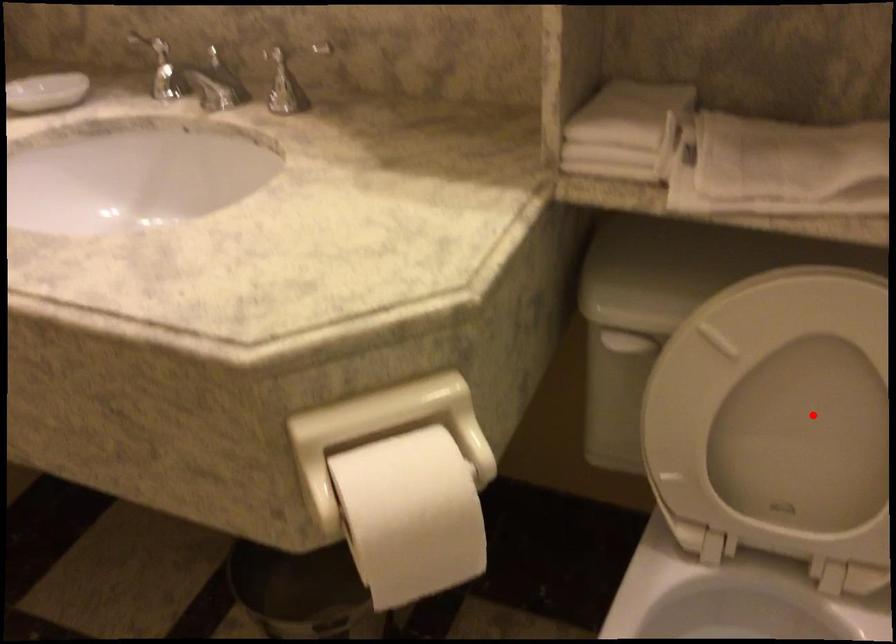
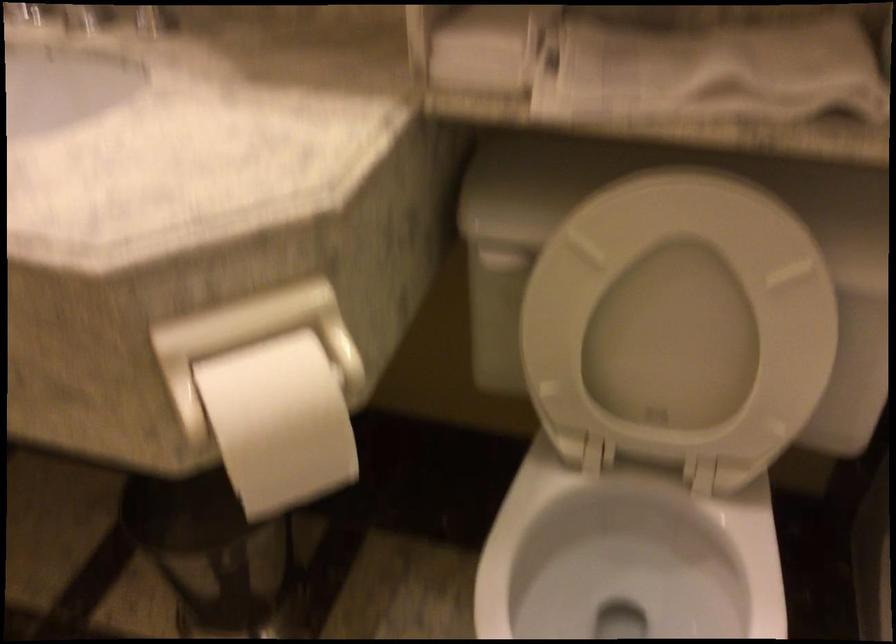
Where in the second image is the point corresponding to the highlighted location from the first image?

(678, 322)